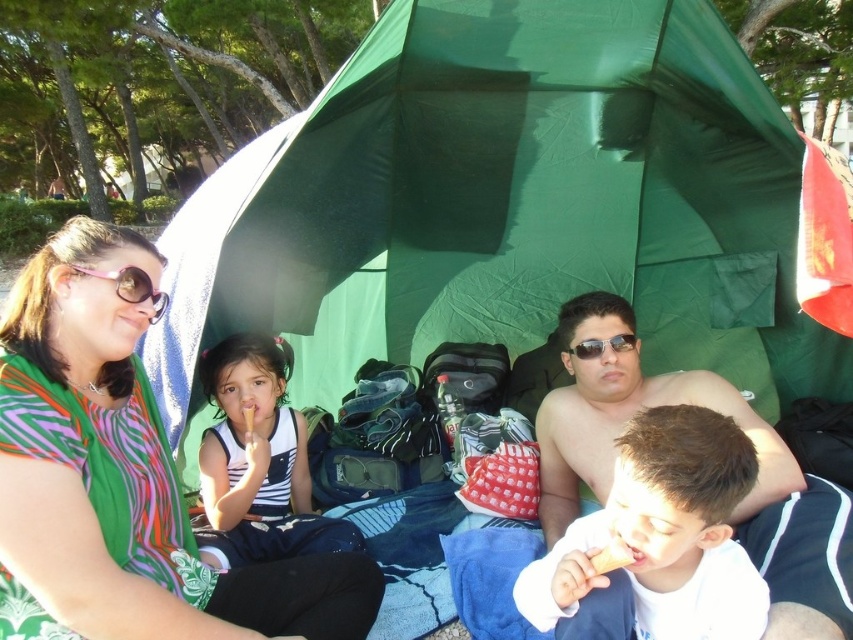
Between printed fabric scarf at upper left and shiny metallic man at center, which one has less height?

Standing shorter between the two is shiny metallic man at center.

Does printed fabric scarf at upper left have a greater width compared to shiny metallic man at center?

Yes, printed fabric scarf at upper left is wider than shiny metallic man at center.

Between point (24, 509) and point (549, 400), which one is positioned behind?

The point (549, 400) is behind.

The image size is (853, 640). Find the location of `printed fabric scarf at upper left`. printed fabric scarf at upper left is located at coordinates (122, 480).

Does green fabric tent at upper center have a smaller size compared to sunglasses at center?

No, green fabric tent at upper center is not smaller than sunglasses at center.

Who is more forward, (416, 344) or (634, 342)?

Positioned in front is point (634, 342).

This screenshot has width=853, height=640. In order to click on green fabric tent at upper center in this screenshot , I will do `click(506, 205)`.

Is point (437, 10) farther from viewer compared to point (129, 289)?

Yes, point (437, 10) is farther from viewer.

Can you confirm if green fabric tent at upper center is thinner than pink plastic goggles at upper left?

In fact, green fabric tent at upper center might be wider than pink plastic goggles at upper left.

Which is in front, point (705, 100) or point (126, 300)?

Positioned in front is point (126, 300).

At what (x,y) coordinates should I click in order to perform the action: click on green fabric tent at upper center. Please return your answer as a coordinate pair (x, y). Looking at the image, I should click on (506, 205).